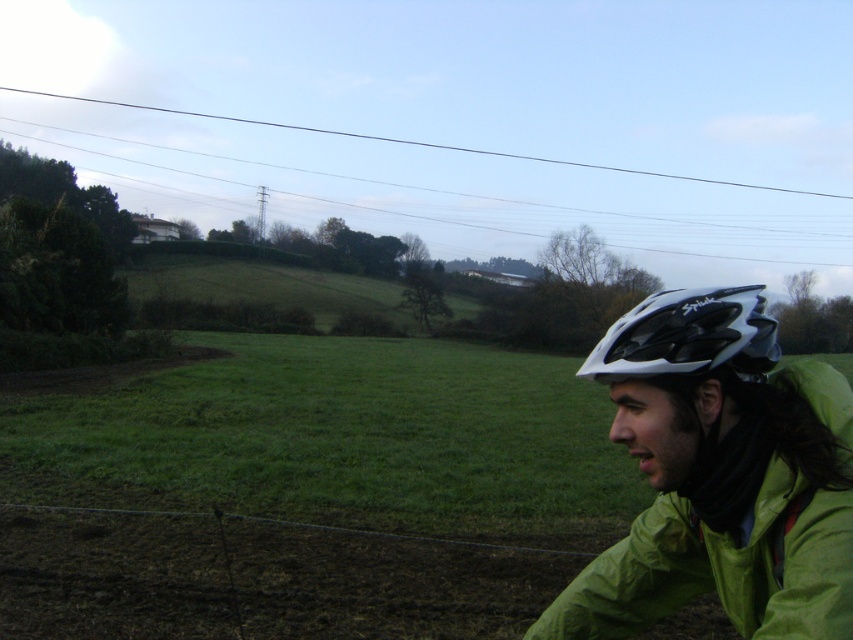
Question: Which point is farther to the camera?

Choices:
 (A) (730, 509)
 (B) (605, 352)

Answer: (B)

Question: Which point is farther from the camera taking this photo?

Choices:
 (A) (770, 428)
 (B) (720, 352)

Answer: (A)

Question: Is green matte jacket at lower right to the left of white matte bicycle helmet at right from the viewer's perspective?

Choices:
 (A) yes
 (B) no

Answer: (A)

Question: Is green matte jacket at lower right to the right of white matte bicycle helmet at right from the viewer's perspective?

Choices:
 (A) no
 (B) yes

Answer: (A)

Question: Among these objects, which one is nearest to the camera?

Choices:
 (A) white matte bicycle helmet at right
 (B) green matte jacket at lower right

Answer: (A)

Question: Is green matte jacket at lower right wider than white matte bicycle helmet at right?

Choices:
 (A) yes
 (B) no

Answer: (B)